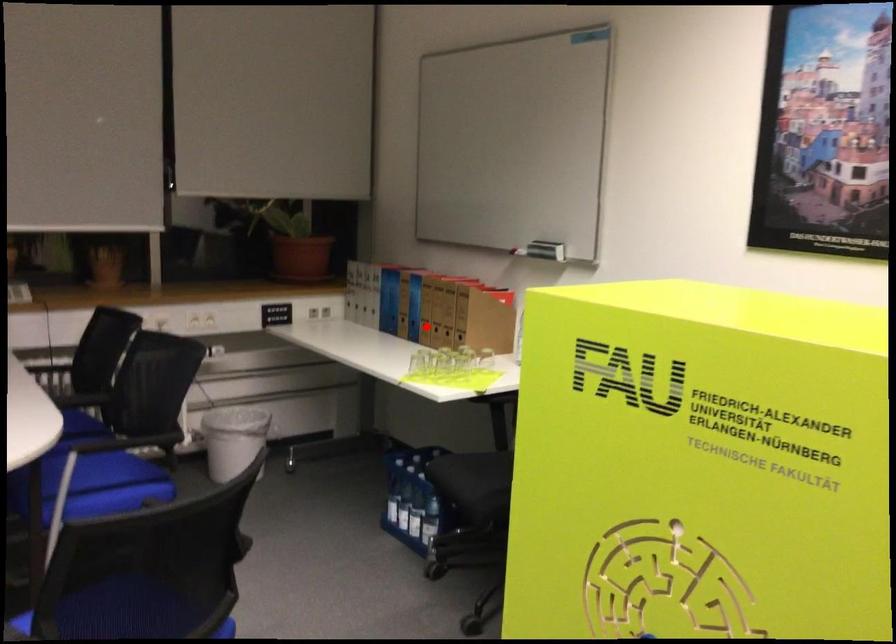
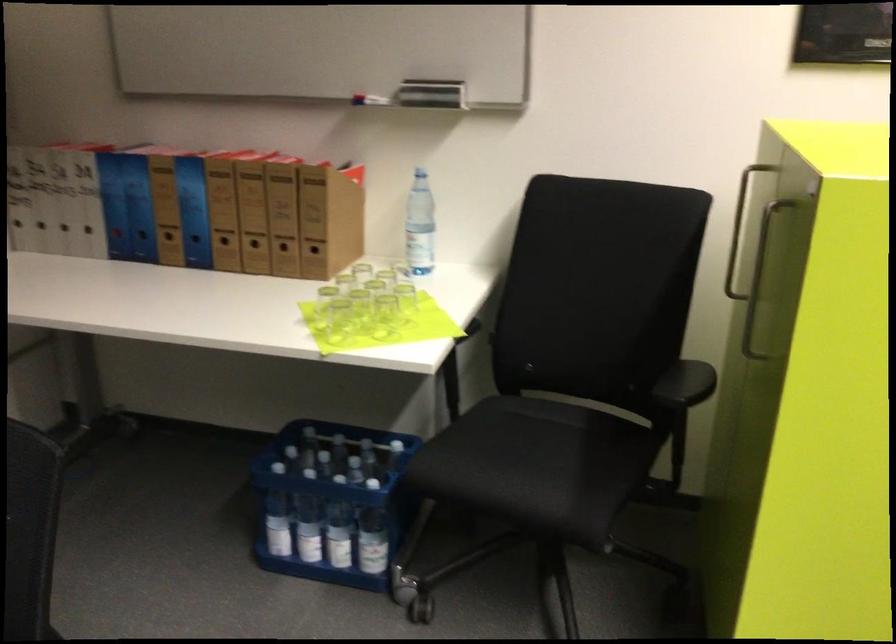
Where in the second image is the point corresponding to the highlighted location from the first image?

(225, 245)